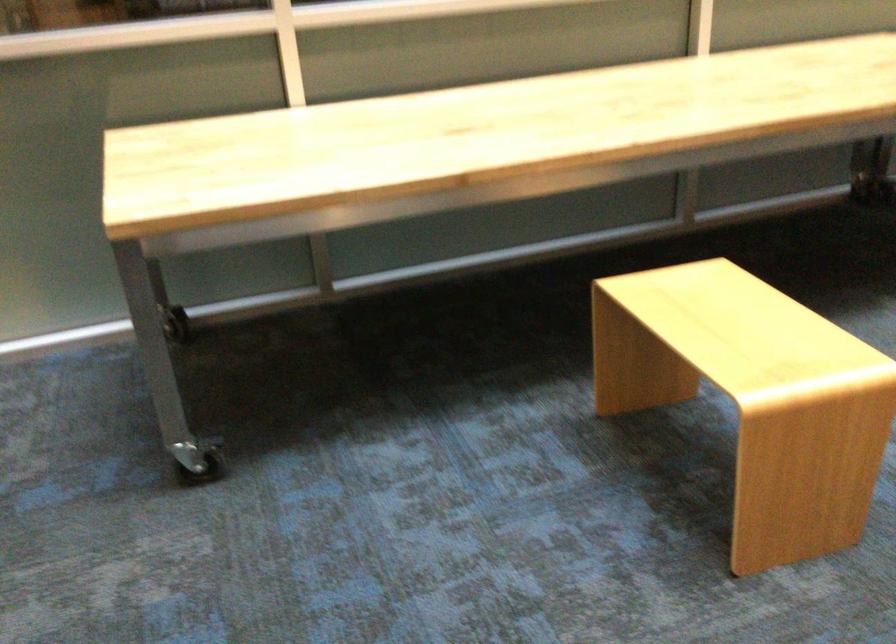
First-person continuous shooting, in which direction is the camera rotating?

The camera rotated toward left-down.